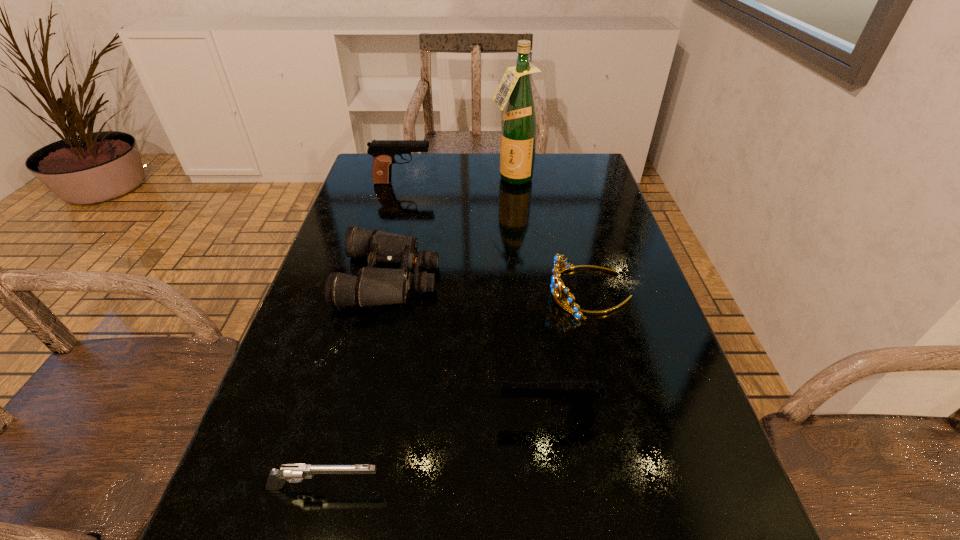
The width and height of the screenshot is (960, 540). I want to click on vacant region located 0.290m at the barrel of the tallest pistol, so click(528, 183).

The width and height of the screenshot is (960, 540). What are the coordinates of `free point located on the front-facing side of the tiara` in the screenshot? It's located at (432, 293).

I want to click on free region located on the front-facing side of the tiara, so click(414, 293).

Find the location of a particular element. vacant space located 0.160m on the front-facing side of the tiara is located at coordinates (477, 293).

Locate an element on the screen. The image size is (960, 540). free point located 0.120m on the front-facing side of the rightmost pistol is located at coordinates (429, 416).

Locate an element on the screen. This screenshot has width=960, height=540. vacant space located 0.350m on the front-facing side of the rightmost pistol is located at coordinates (295, 416).

Locate an element on the screen. The image size is (960, 540). vacant space situated on the front-facing side of the rightmost pistol is located at coordinates (289, 416).

Identify the location of blank area located 0.260m through the eyepieces of the binoculars. (550, 277).

At what (x,y) coordinates should I click in order to perform the action: click on blank space located on the front-facing side of the nearest object. Please return your answer as a coordinate pair (x, y). This screenshot has height=540, width=960. Looking at the image, I should click on (607, 488).

This screenshot has height=540, width=960. Find the location of `liquor that is at the far edge`. liquor that is at the far edge is located at coordinates (519, 124).